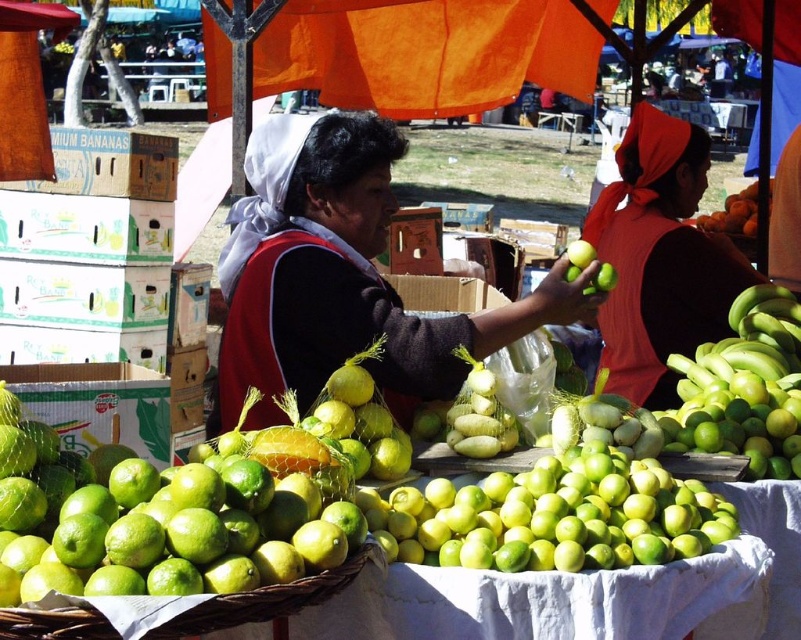
Does matte red vest at center have a smaller size compared to smooth orange pumpkin at center?

Actually, matte red vest at center might be larger than smooth orange pumpkin at center.

Is point (643, 388) less distant than point (735, 208)?

Yes, point (643, 388) is closer to viewer.

This screenshot has height=640, width=801. What are the coordinates of `matte red vest at center` in the screenshot? It's located at [x=659, y=259].

Does green matte bananas at right have a lesser height compared to smooth orange pumpkin at center?

No.

Is green matte bananas at right wider than smooth orange pumpkin at center?

In fact, green matte bananas at right might be narrower than smooth orange pumpkin at center.

Who is more forward, (781, 448) or (735, 211)?

Positioned in front is point (781, 448).

Locate an element on the screen. The height and width of the screenshot is (640, 801). green matte bananas at right is located at coordinates (743, 387).

Who is more distant from viewer, (x=103, y=636) or (x=600, y=291)?

The point (x=600, y=291) is more distant.

Can you confirm if green woven basket at lower left is positioned to the right of green matte apple at center?

Incorrect, green woven basket at lower left is not on the right side of green matte apple at center.

Locate an element on the screen. This screenshot has width=801, height=640. green woven basket at lower left is located at coordinates (264, 602).